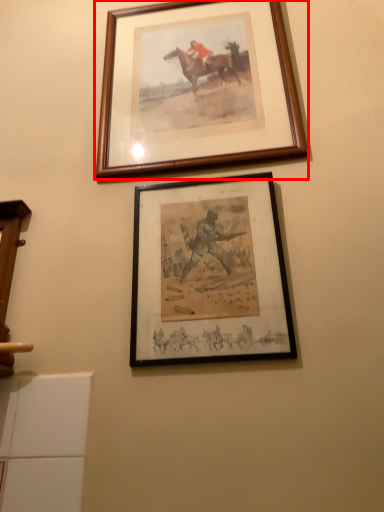
Question: From the image's perspective, what is the correct spatial relationship of picture frame (annotated by the red box) in relation to picture frame?

Choices:
 (A) below
 (B) above

Answer: (B)